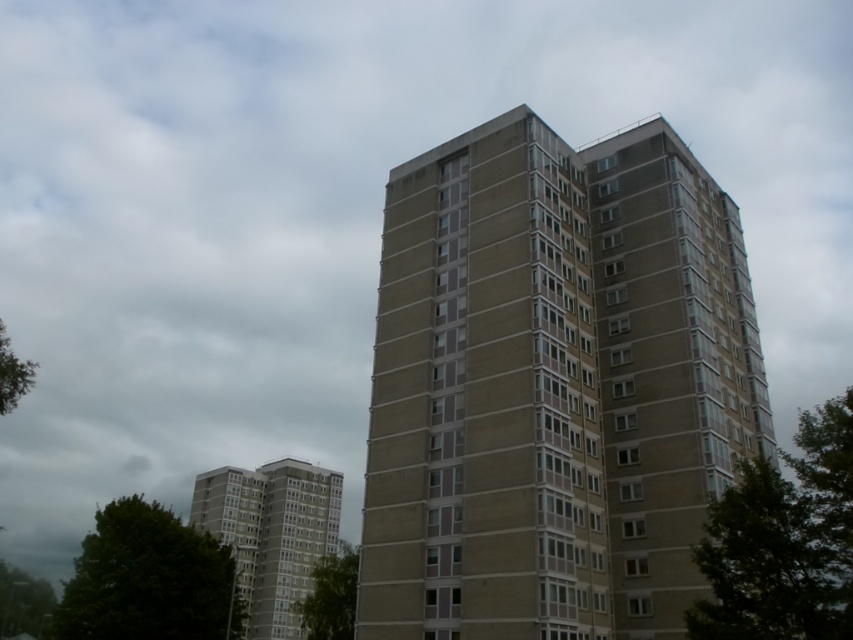
Between concrete tower block at center and concrete building at lower left, which one appears on the right side from the viewer's perspective?

concrete tower block at center is more to the right.

Is concrete tower block at center further to the viewer compared to concrete building at lower left?

No, concrete tower block at center is closer to the viewer.

Is point (549, 324) behind point (335, 477)?

No, (549, 324) is in front of (335, 477).

Locate an element on the screen. The image size is (853, 640). concrete tower block at center is located at coordinates (552, 385).

Can you confirm if concrete building at lower left is thinner than green leafy tree at lower center?

Incorrect, concrete building at lower left's width is not less than green leafy tree at lower center's.

Who is positioned more to the left, concrete building at lower left or green leafy tree at lower center?

concrete building at lower left is more to the left.

What do you see at coordinates (271, 534) in the screenshot? Image resolution: width=853 pixels, height=640 pixels. I see `concrete building at lower left` at bounding box center [271, 534].

Where is `concrete building at lower left`? concrete building at lower left is located at coordinates (271, 534).

Between green leafy tree at lower left and green leafy tree at lower center, which one appears on the right side from the viewer's perspective?

From the viewer's perspective, green leafy tree at lower center appears more on the right side.

Between green leafy tree at lower left and green leafy tree at lower center, which one is positioned lower?

Positioned lower is green leafy tree at lower left.

At what (x,y) coordinates should I click in order to perform the action: click on green leafy tree at lower left. Please return your answer as a coordinate pair (x, y). The height and width of the screenshot is (640, 853). Looking at the image, I should click on (148, 579).